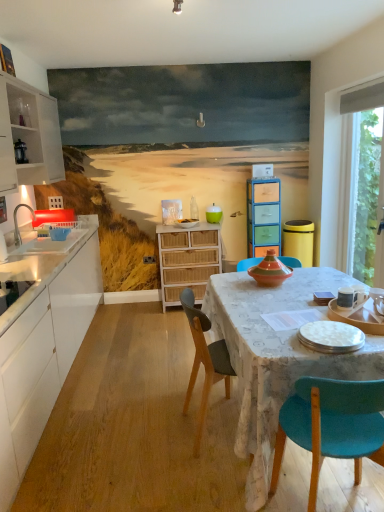
At what (x,y) coordinates should I click in order to perform the action: click on free spot above white wicker chest of drawers at center (from a real-world perspective). Please return your answer as a coordinate pair (x, y). This screenshot has height=512, width=384. Looking at the image, I should click on (185, 224).